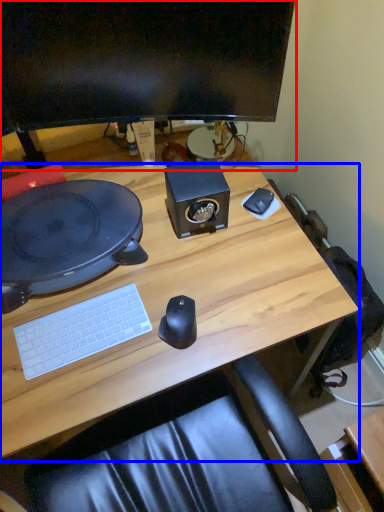
Question: Among these objects, which one is farthest to the camera, computer monitor (highlighted by a red box) or desk (highlighted by a blue box)?

Choices:
 (A) computer monitor
 (B) desk

Answer: (A)